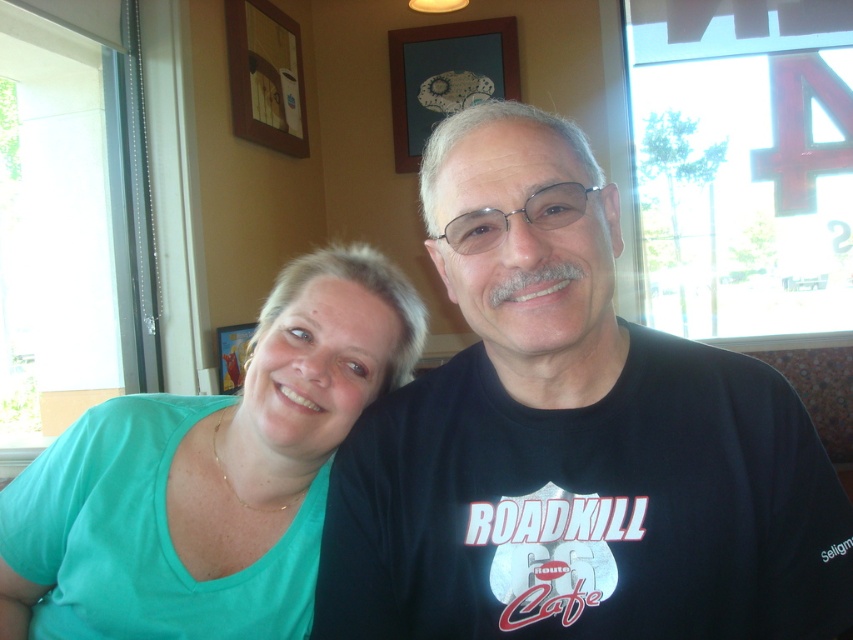
Is black matte t-shirt at center to the left of teal matte shirt at left from the viewer's perspective?

No, black matte t-shirt at center is not to the left of teal matte shirt at left.

Is point (764, 435) positioned before point (90, 513)?

Yes.

Between point (666, 548) and point (231, 564), which one is positioned in front?

Point (666, 548)

Identify the location of black matte t-shirt at center. (572, 440).